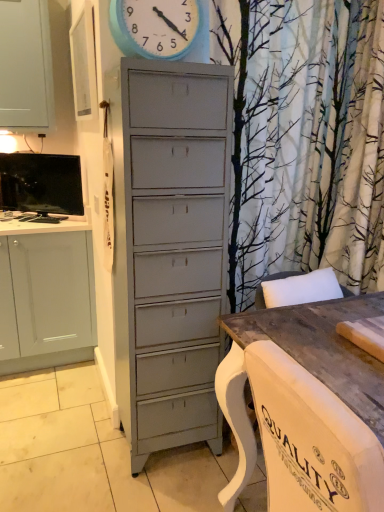
Identify the location of free spot above matte black tv at upper left (from a real-world perspective). This screenshot has height=512, width=384. (18, 156).